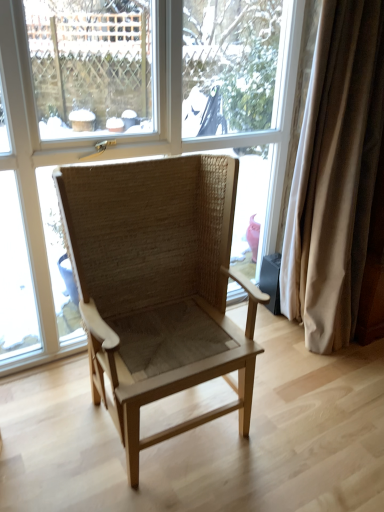
Where is `free region under natural woven chair at center (from a real-world perspective)`? free region under natural woven chair at center (from a real-world perspective) is located at coordinates (170, 422).